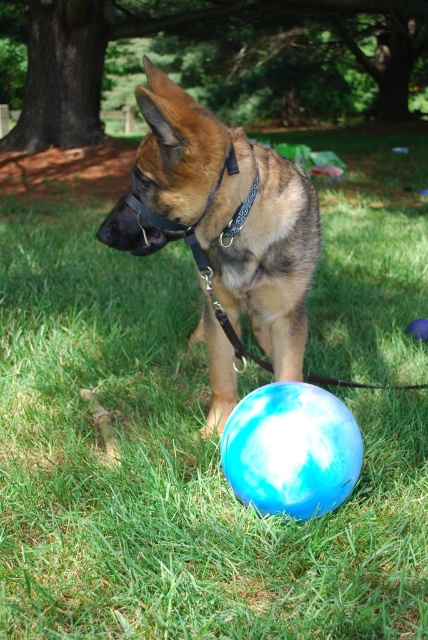
You are a dog trainer observing the brown fur dog at center and the blue glossy ball at center. Which object is bigger?

The brown fur dog at center is larger in size compared to the blue glossy ball at center.

From the picture: You are standing in a park and see two points marked on the ground. The first point is at coordinate point (171, 134) and the second point is at coordinate point (261, 424). Which point is closer to you?

Point (171, 134) is further to the viewer than point (261, 424). Therefore, point (261, 424) is closer to you.